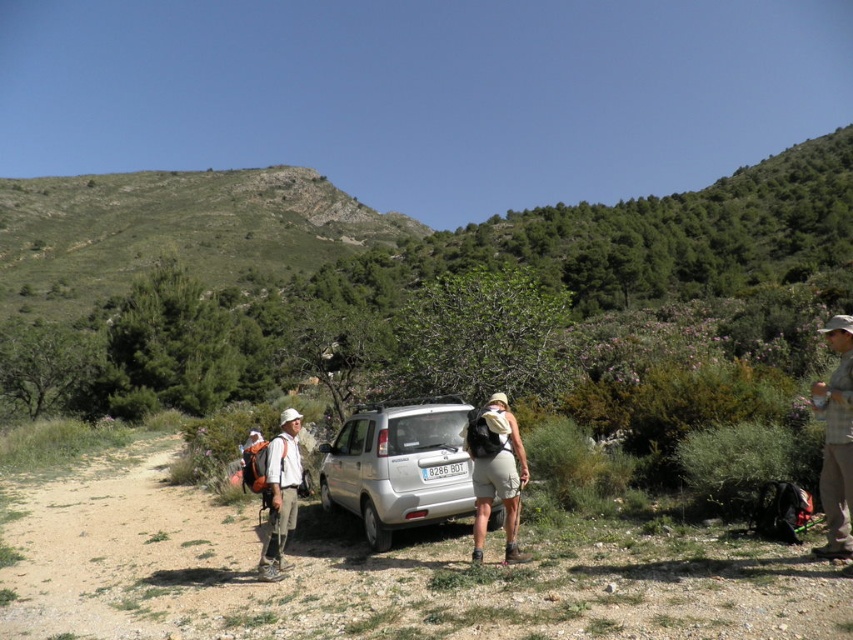
This screenshot has height=640, width=853. Describe the element at coordinates (496, 472) in the screenshot. I see `matte khaki shorts at center` at that location.

Can you confirm if matte khaki shorts at center is positioned to the left of camouflage fabric backpack at left?

Incorrect, matte khaki shorts at center is not on the left side of camouflage fabric backpack at left.

Which is behind, point (486, 520) or point (282, 548)?

Positioned behind is point (282, 548).

Locate an element on the screen. matte khaki shorts at center is located at coordinates (496, 472).

Describe the element at coordinates (379, 576) in the screenshot. I see `gravel path at center` at that location.

Between gravel path at center and plaid shirt at right, which one has less height?

Standing shorter between the two is plaid shirt at right.

What do you see at coordinates (379, 576) in the screenshot?
I see `gravel path at center` at bounding box center [379, 576].

Find the location of `gravel path at center`. gravel path at center is located at coordinates (379, 576).

Does gravel path at center appear under camouflage fabric backpack at left?

Indeed, gravel path at center is positioned under camouflage fabric backpack at left.

Is the position of gravel path at center less distant than that of camouflage fabric backpack at left?

Yes, it is in front of camouflage fabric backpack at left.

Is point (628, 525) farther from camera compared to point (293, 432)?

Yes.

The height and width of the screenshot is (640, 853). I want to click on gravel path at center, so click(x=379, y=576).